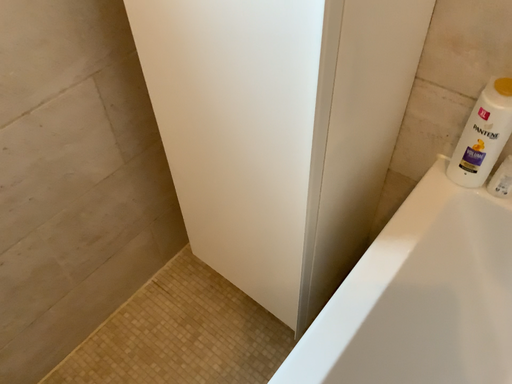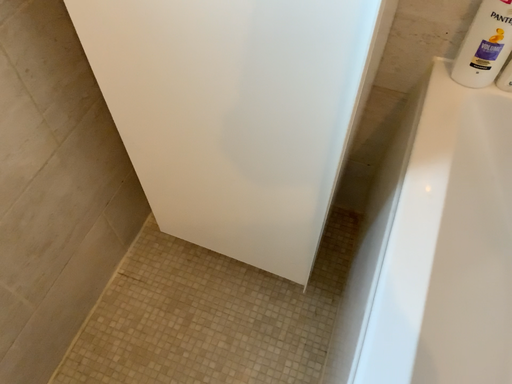
Question: Which way did the camera rotate in the video?

Choices:
 (A) rotated upward
 (B) rotated downward

Answer: (B)